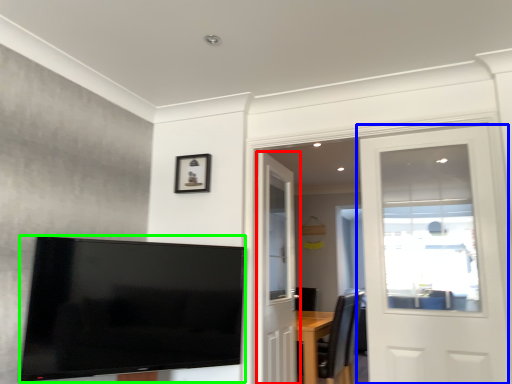
Question: Which object is the farthest from door (highlighted by a red box)? Choose among these: door (highlighted by a blue box) or television (highlighted by a green box).

Choices:
 (A) door
 (B) television

Answer: (A)